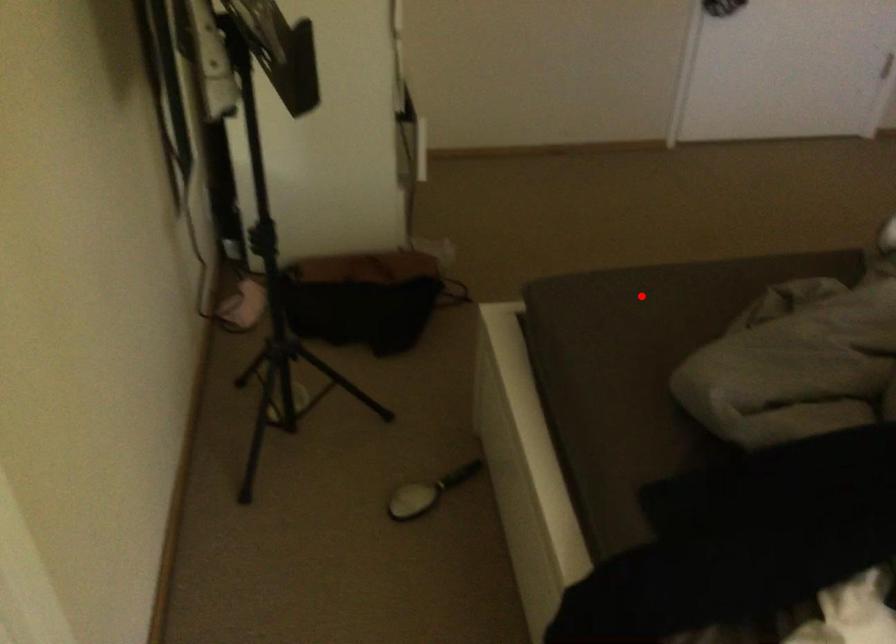
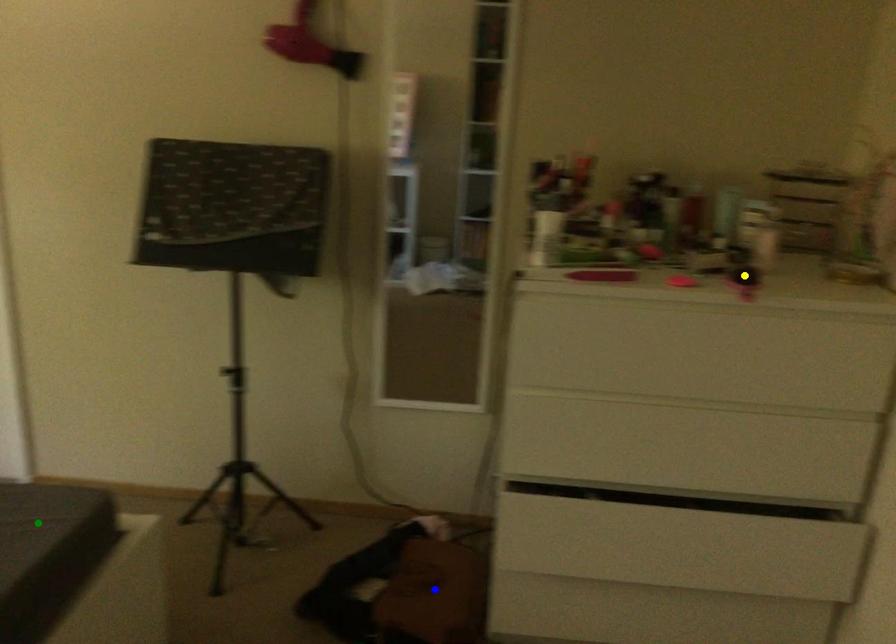
Question: I am providing you with two images of the same scene from different viewpoints. A red point is marked on the first image. You are given multiple points on the second image. Which mark in image 2 goes with the point in image 1?

Choices:
 (A) green point
 (B) blue point
 (C) yellow point

Answer: (A)